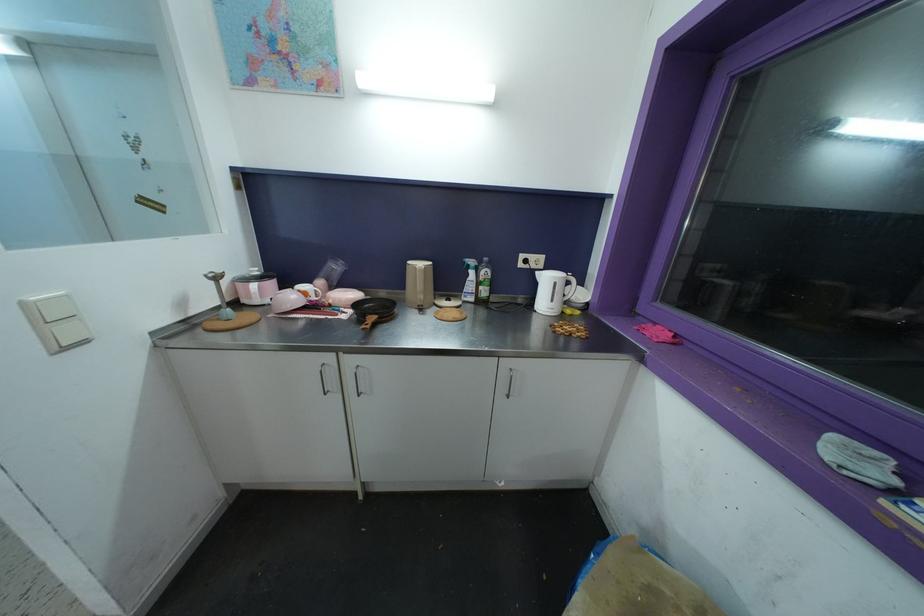
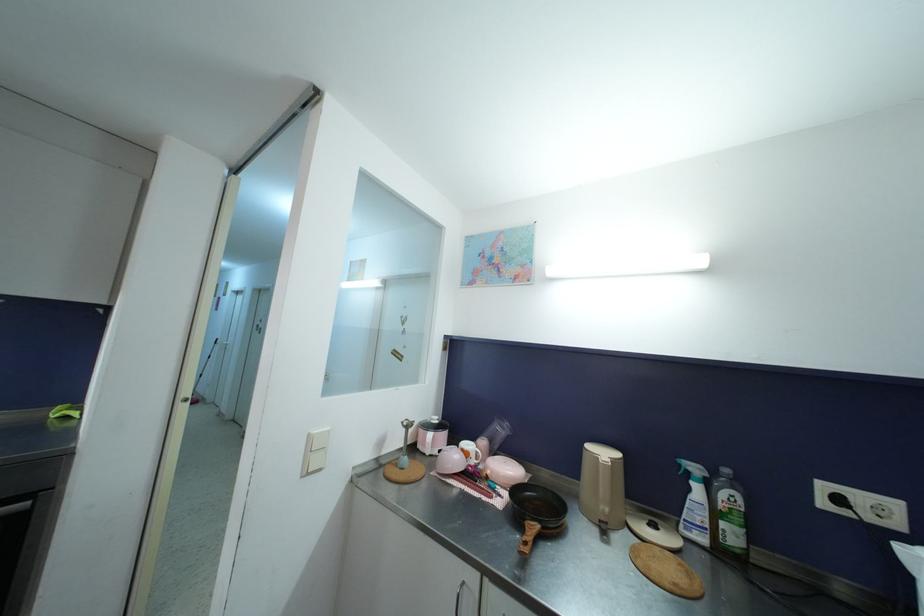
In the second image, find the point that corresponds to pixel 308 296 in the first image.

(469, 456)